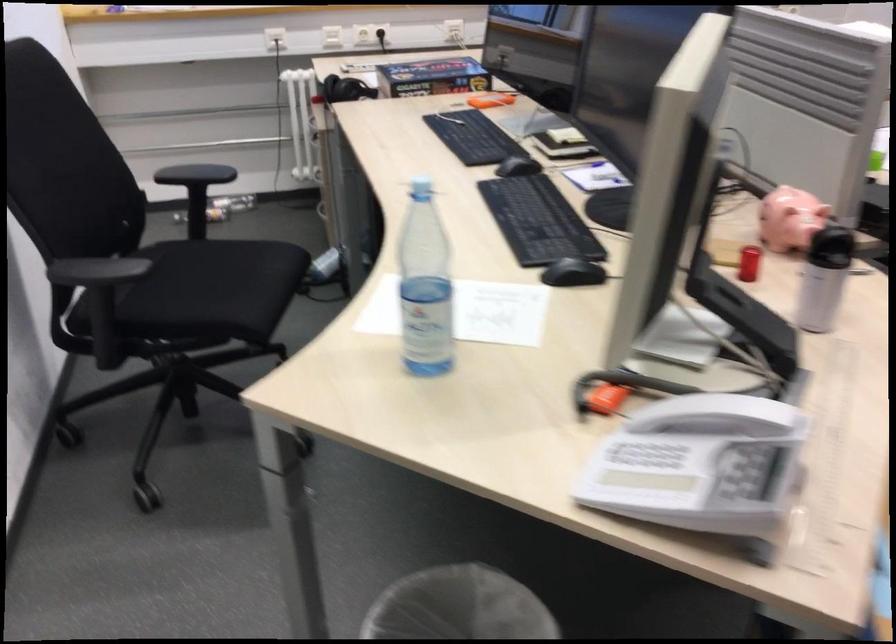
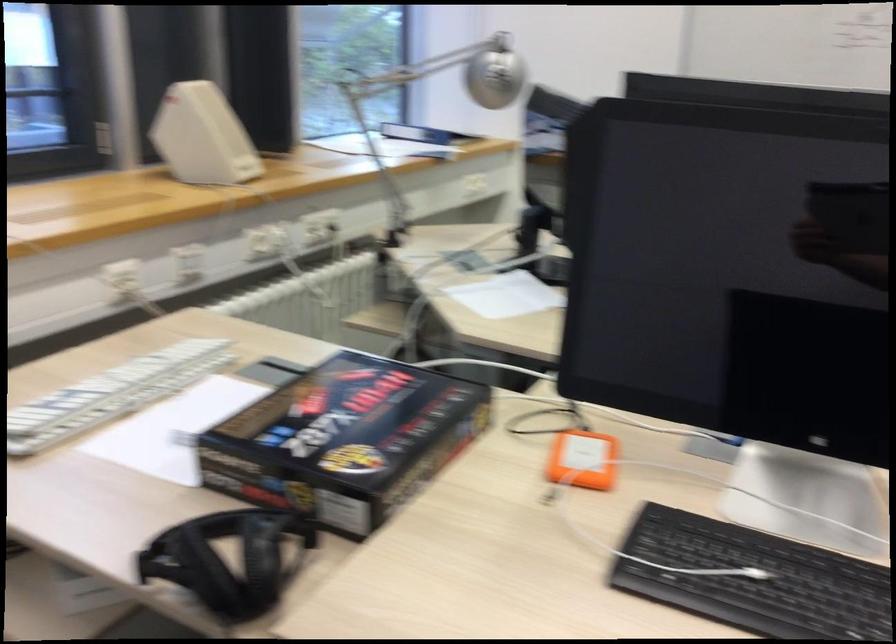
Where in the second image is the point corresponding to the point at 409,73 from the first image?

(345, 440)